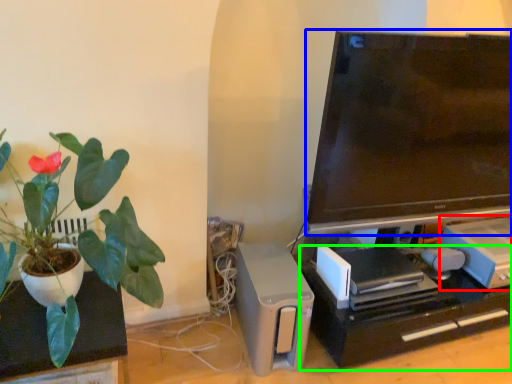
Question: Estimate the real-world distances between objects in this image. Which object is farther from appliance (highlighted by a red box), television (highlighted by a blue box) or computer desk (highlighted by a green box)?

Choices:
 (A) television
 (B) computer desk

Answer: (A)